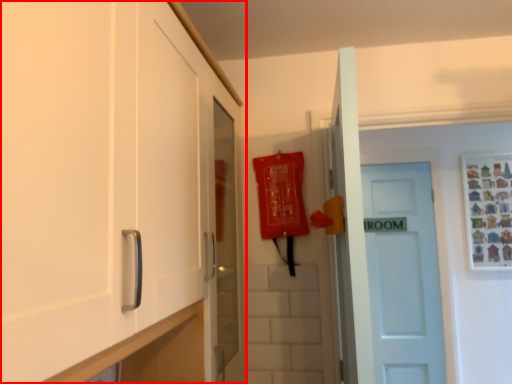
Question: Where is cabinetry (annotated by the red box) located in relation to door in the image?

Choices:
 (A) right
 (B) left

Answer: (B)